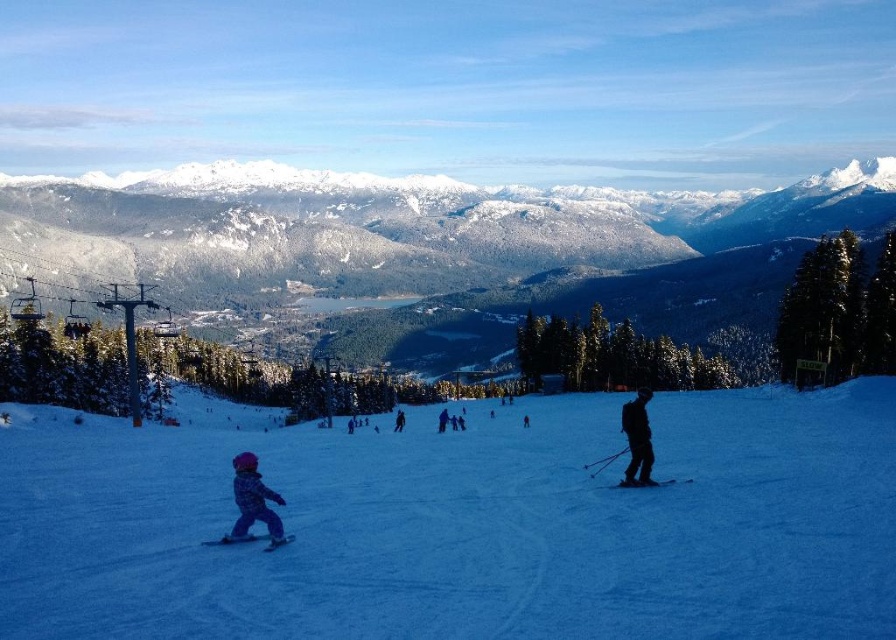
Is white snow ski slope at lower left bigger than purple snowsuit at lower left?

Yes.

In the scene shown: Can you confirm if white snow ski slope at lower left is positioned to the right of purple snowsuit at lower left?

Yes, white snow ski slope at lower left is to the right of purple snowsuit at lower left.

Does point (217, 476) lie behind point (253, 476)?

Yes, point (217, 476) is farther from viewer.

Where is `white snow ski slope at lower left`? white snow ski slope at lower left is located at coordinates (464, 525).

Who is positioned more to the left, blue matte ski at lower left or dark blue ski suit at center?

dark blue ski suit at center

Is point (287, 536) closer to viewer compared to point (401, 410)?

Yes, point (287, 536) is in front of point (401, 410).

The width and height of the screenshot is (896, 640). Find the location of `blue matte ski at lower left`. blue matte ski at lower left is located at coordinates (251, 540).

Is snowy forested mountain at upper center positioned behind black matte ski at center?

Yes, it is behind black matte ski at center.

Who is more distant from viewer, (668,323) or (652,486)?

The point (668,323) is more distant.

Which is behind, point (665, 236) or point (635, 488)?

Positioned behind is point (665, 236).

You are a GUI agent. You are given a task and a screenshot of the screen. Output one action in this format:
    pyautogui.click(x=<x>, y=<y>)
    Task: Click on the snowy forested mountain at upper center
    The width and height of the screenshot is (896, 640).
    Given the screenshot: What is the action you would take?
    pyautogui.click(x=434, y=246)